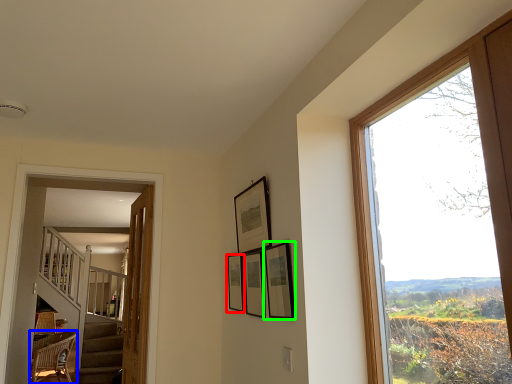
Question: Which object is positioned farthest from picture frame (highlighted by a red box)? Select from chair (highlighted by a blue box) and picture frame (highlighted by a green box).

Choices:
 (A) chair
 (B) picture frame

Answer: (A)